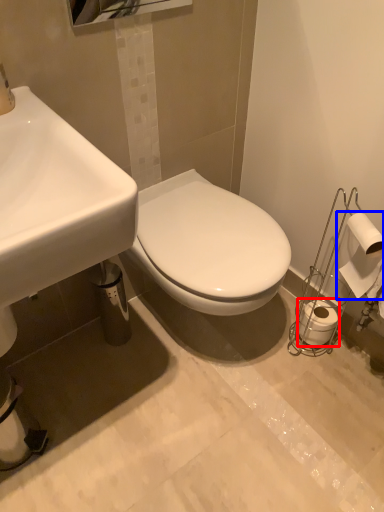
Question: Among these objects, which one is nearest to the camera, toilet paper (highlighted by a red box) or toilet paper (highlighted by a blue box)?

Choices:
 (A) toilet paper
 (B) toilet paper

Answer: (B)